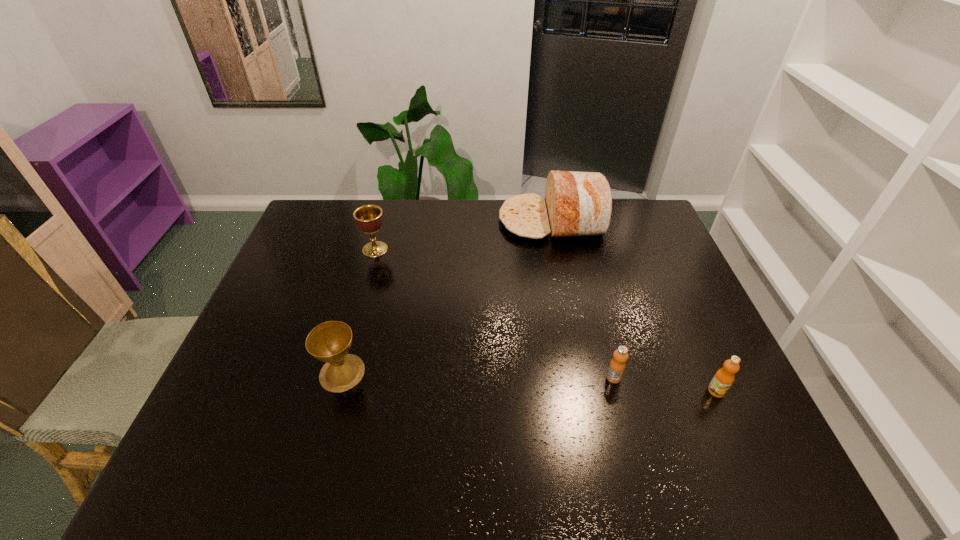
This screenshot has width=960, height=540. What are the coordinates of `the tallest object` in the screenshot? It's located at (577, 204).

At what (x,y) coordinates should I click in order to perform the action: click on the farther chalice. Please return your answer as a coordinate pair (x, y). Looking at the image, I should click on (369, 218).

I want to click on the nearer chalice, so click(x=329, y=342).

At what (x,y) coordinates should I click in order to perform the action: click on the right orange juice. Please return your answer as a coordinate pair (x, y). Image resolution: width=960 pixels, height=540 pixels. Looking at the image, I should click on (723, 379).

Locate an element on the screen. The width and height of the screenshot is (960, 540). the left orange juice is located at coordinates coord(617,365).

The width and height of the screenshot is (960, 540). Identify the location of vacant position located at the sliced end of the tallest object. (466, 220).

Identify the location of vacant space located at the sliced end of the tallest object. (415, 220).

You are a GUI agent. You are given a task and a screenshot of the screen. Output one action in this format:
    pyautogui.click(x=<x>, y=<y>)
    Task: Click on the free space located 0.070m at the sliced end of the tallest object
    The image size is (960, 540).
    Given the screenshot: What is the action you would take?
    pyautogui.click(x=479, y=220)

You are a GUI agent. You are given a task and a screenshot of the screen. Output one action in this format:
    pyautogui.click(x=<x>, y=<y>)
    Task: Click on the vacant area situated on the front of the farther chalice
    
    Given the screenshot: What is the action you would take?
    pyautogui.click(x=361, y=301)

Where is `vacant area situated 0.160m on the front of the nearer chalice`? This screenshot has width=960, height=540. vacant area situated 0.160m on the front of the nearer chalice is located at coordinates (319, 458).